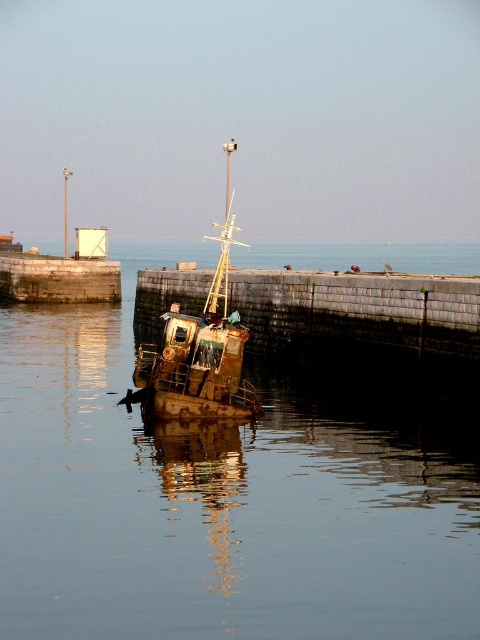
Question: Is smooth water at center bigger than rusty metal boat at center?

Choices:
 (A) yes
 (B) no

Answer: (A)

Question: Does smooth water at center appear on the left side of rusty metal boat at center?

Choices:
 (A) no
 (B) yes

Answer: (B)

Question: Which point appears farthest from the camera in this image?

Choices:
 (A) (231, 355)
 (B) (340, 598)

Answer: (A)

Question: Which point is farther to the camera?

Choices:
 (A) pyautogui.click(x=430, y=433)
 (B) pyautogui.click(x=157, y=397)

Answer: (A)

Question: Is smooth water at center above rusty metal boat at center?

Choices:
 (A) yes
 (B) no

Answer: (B)